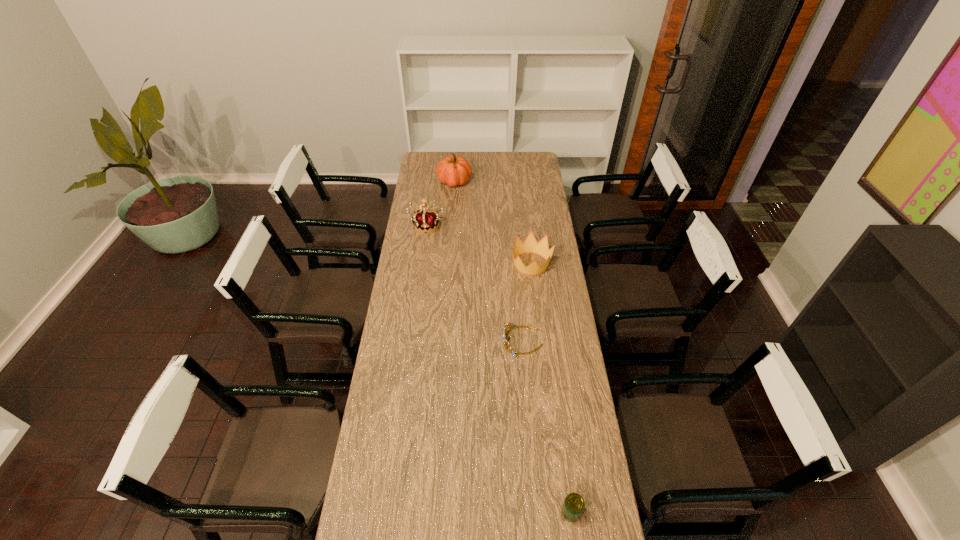
Locate an element on the screen. The image size is (960, 540). beer can located at the right edge is located at coordinates (573, 506).

At what (x,y) coordinates should I click in order to perform the action: click on object that is at the far left corner. Please return your answer as a coordinate pair (x, y). The height and width of the screenshot is (540, 960). Looking at the image, I should click on [x=453, y=170].

The image size is (960, 540). In the image, there is a desktop. Find the location of `vacant space at the far edge`. vacant space at the far edge is located at coordinates (484, 170).

Where is `vacant position at the left edge of the desktop`? The width and height of the screenshot is (960, 540). vacant position at the left edge of the desktop is located at coordinates (384, 502).

At what (x,y) coordinates should I click in order to perform the action: click on vacant space at the right edge of the desktop. Please return your answer as a coordinate pair (x, y). Looking at the image, I should click on (560, 264).

You are a GUI agent. You are given a task and a screenshot of the screen. Output one action in this format:
    pyautogui.click(x=<x>, y=<y>)
    Task: Click on the vacant space at the far left corner
    This screenshot has width=960, height=540.
    Given the screenshot: What is the action you would take?
    pyautogui.click(x=444, y=154)

I want to click on free area in between the second nearest object and the crown, so click(x=527, y=303).

Locate an element on the screen. The height and width of the screenshot is (540, 960). empty location between the crown and the farthest object is located at coordinates (492, 223).

Identify the location of free space between the farthest object and the nearer tiara. point(489,261).

Where is `empty location between the shorter tiara and the pumpkin`? The height and width of the screenshot is (540, 960). empty location between the shorter tiara and the pumpkin is located at coordinates (489, 261).